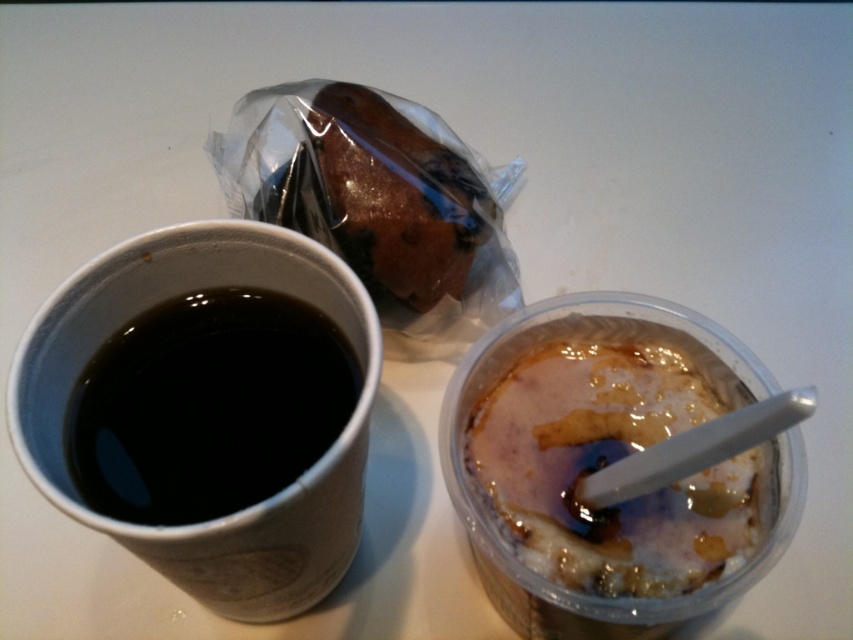
Between spongy white cake at center and brown/crumbly pastry at upper center, which one has more height?

With more height is brown/crumbly pastry at upper center.

Does point (509, 444) lie behind point (373, 230)?

No.

Image resolution: width=853 pixels, height=640 pixels. What are the coordinates of `spongy white cake at center` in the screenshot? It's located at (606, 465).

Find the location of a particular element. This screenshot has width=853, height=640. spongy white cake at center is located at coordinates (606, 465).

Is black matte cup at left taller than brown/crumbly pastry at upper center?

Incorrect, black matte cup at left's height is not larger of brown/crumbly pastry at upper center's.

Which of these two, black matte cup at left or brown/crumbly pastry at upper center, stands shorter?

black matte cup at left

Describe the element at coordinates (207, 406) in the screenshot. I see `black matte cup at left` at that location.

Identify the location of black matte cup at left. click(207, 406).

Is black paper cup at left behind brown/crumbly pastry at upper center?

No, black paper cup at left is closer to the viewer.

Between point (289, 525) and point (347, 257), which one is positioned behind?

Point (347, 257)

You are a GUI agent. You are given a task and a screenshot of the screen. Output one action in this format:
    pyautogui.click(x=<x>, y=<y>)
    Task: Click on the black paper cup at left
    This screenshot has height=640, width=853.
    Given the screenshot: What is the action you would take?
    pyautogui.click(x=245, y=509)

Identify the location of black paper cup at left. (245, 509).